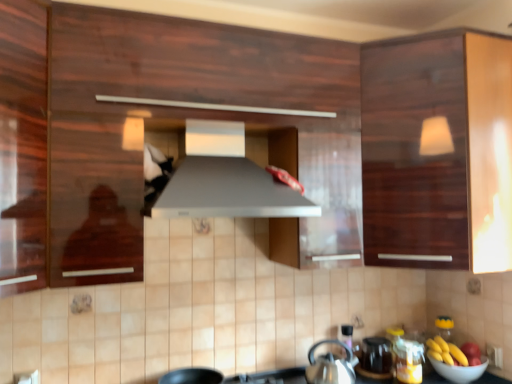
Find the location of a particular element. The width and height of the screenshot is (512, 384). satin silver exhaust hood at center is located at coordinates (226, 181).

I want to click on yellow matte bananas at lower right, so click(x=448, y=353).

You are a GUI agent. You are given a task and a screenshot of the screen. Output one action in this format:
    pyautogui.click(x=<x>, y=<y>)
    Task: Click on the glossy wood cabinet at upper right
    
    Given the screenshot: What is the action you would take?
    pyautogui.click(x=438, y=151)

What do you see at coordinates (376, 355) in the screenshot? I see `matte black kettle at lower center` at bounding box center [376, 355].

Find the location of a particular element. The image size is (512, 384). satin silver exhaust hood at center is located at coordinates (226, 181).

Considering the relative sizes of satin silver exhaust hood at center and glossy wood cabinet at upper right in the image provided, is satin silver exhaust hood at center taller than glossy wood cabinet at upper right?

Incorrect, the height of satin silver exhaust hood at center is not larger of that of glossy wood cabinet at upper right.

From a real-world perspective, which is physically above, satin silver exhaust hood at center or glossy wood cabinet at upper right?

From a 3D spatial view, glossy wood cabinet at upper right is above.

Can you confirm if satin silver exhaust hood at center is thinner than glossy wood cabinet at upper right?

Yes, satin silver exhaust hood at center is thinner than glossy wood cabinet at upper right.

Could you tell me if satin silver exhaust hood at center is facing glossy wood cabinet at upper right?

No.

From a real-world perspective, is matte black kettle at lower center positioned above or below silver metallic kettle at lower center?

matte black kettle at lower center is situated lower than silver metallic kettle at lower center in the real world.

Relative to silver metallic kettle at lower center, is matte black kettle at lower center in front or behind?

Visually, matte black kettle at lower center is located behind silver metallic kettle at lower center.

Is matte black kettle at lower center not close to silver metallic kettle at lower center?

matte black kettle at lower center is near silver metallic kettle at lower center, not far away.

Considering the points (370, 347) and (315, 360), which point is in front, point (370, 347) or point (315, 360)?

The point (315, 360) is more forward.

From the image's perspective, who appears lower, white glossy bowl at lower right or satin silver exhaust hood at center?

white glossy bowl at lower right.

Is white glossy bowl at lower right oriented away from satin silver exhaust hood at center?

No.

Is point (460, 382) closer or farther from the camera than point (230, 205)?

Point (460, 382) is farther from the camera than point (230, 205).

In the image, there is a satin silver exhaust hood at center. Where is `bowl below it (from the image's perspective)`? Image resolution: width=512 pixels, height=384 pixels. bowl below it (from the image's perspective) is located at coordinates (459, 370).

The height and width of the screenshot is (384, 512). I want to click on kitchen appliance behind the glossy wood cabinet at upper right, so click(331, 366).

From the picture: From the image's perspective, is glossy wood cabinet at upper right above silver metallic kettle at lower center?

Yes, from the image's perspective, glossy wood cabinet at upper right is over silver metallic kettle at lower center.

Could silver metallic kettle at lower center be considered to be inside glossy wood cabinet at upper right?

No, silver metallic kettle at lower center is not a part of glossy wood cabinet at upper right.

Between glossy wood cabinet at upper right and silver metallic kettle at lower center, which one has more height?

glossy wood cabinet at upper right is taller.

Which object is positioned more to the right, silver metallic kettle at lower center or white glossy bowl at lower right?

white glossy bowl at lower right is more to the right.

Considering the relative positions of silver metallic kettle at lower center and white glossy bowl at lower right in the image provided, is silver metallic kettle at lower center behind white glossy bowl at lower right?

No.

From a real-world perspective, is silver metallic kettle at lower center above or below white glossy bowl at lower right?

From a real-world perspective, silver metallic kettle at lower center is physically above white glossy bowl at lower right.

Is silver metallic kettle at lower center oriented away from white glossy bowl at lower right?

silver metallic kettle at lower center does not have its back to white glossy bowl at lower right.

Is the position of matte black kettle at lower center more distant than that of yellow matte bananas at lower right?

Yes, the depth of matte black kettle at lower center is greater than that of yellow matte bananas at lower right.

Is matte black kettle at lower center shorter than yellow matte bananas at lower right?

No, matte black kettle at lower center is not shorter than yellow matte bananas at lower right.

Is matte black kettle at lower center to the left or to the right of yellow matte bananas at lower right in the image?

Based on their positions, matte black kettle at lower center is located to the left of yellow matte bananas at lower right.

From the image's perspective, which is below, matte black kettle at lower center or yellow matte bananas at lower right?

matte black kettle at lower center.

Could you tell me if satin silver exhaust hood at center is facing silver metallic kettle at lower center?

No, satin silver exhaust hood at center is not turned towards silver metallic kettle at lower center.

Which is more to the right, satin silver exhaust hood at center or silver metallic kettle at lower center?

Positioned to the right is silver metallic kettle at lower center.

From the image's perspective, is satin silver exhaust hood at center on top of silver metallic kettle at lower center?

Yes, from the image's perspective, satin silver exhaust hood at center is over silver metallic kettle at lower center.

Identify the location of exhaust hood lying below the glossy wood cabinet at upper right (from the image's perspective). This screenshot has width=512, height=384. (226, 181).

What are the coordinates of `kitchen appliance lying on the left of matte black kettle at lower center` in the screenshot? It's located at (331, 366).

Estimate the real-world distances between objects in this image. Which object is closer to satin silver exhaust hood at center, glossy wood cabinet at upper right or yellow matte bananas at lower right?

glossy wood cabinet at upper right is positioned closer to the anchor satin silver exhaust hood at center.

Based on their spatial positions, is white glossy bowl at lower right or silver metallic kettle at lower center further from satin silver exhaust hood at center?

The object further to satin silver exhaust hood at center is white glossy bowl at lower right.

Looking at the image, which one is located further to satin silver exhaust hood at center, yellow matte bananas at lower right or matte black kettle at lower center?

yellow matte bananas at lower right is further to satin silver exhaust hood at center.

Which object lies further to the anchor point matte black kettle at lower center, glossy wood cabinet at upper right or satin silver exhaust hood at center?

satin silver exhaust hood at center.

From the image, which object appears to be nearer to glossy wood cabinet at upper right, silver metallic kettle at lower center or yellow matte bananas at lower right?

silver metallic kettle at lower center.

From the picture: Looking at the image, which one is located closer to yellow matte bananas at lower right, matte black kettle at lower center or white glossy bowl at lower right?

white glossy bowl at lower right.

Estimate the real-world distances between objects in this image. Which object is further from silver metallic kettle at lower center, white glossy bowl at lower right or glossy wood cabinet at upper right?

glossy wood cabinet at upper right is further to silver metallic kettle at lower center.

Based on their spatial positions, is satin silver exhaust hood at center or yellow matte bananas at lower right further from matte black kettle at lower center?

satin silver exhaust hood at center lies further to matte black kettle at lower center than the other object.

Find the location of a particular element. The height and width of the screenshot is (384, 512). banana located between matte black kettle at lower center and white glossy bowl at lower right in the left-right direction is located at coordinates (448, 353).

Identify the location of banana that lies between glossy wood cabinet at upper right and white glossy bowl at lower right from top to bottom. This screenshot has height=384, width=512. (448, 353).

This screenshot has width=512, height=384. Find the location of `appliance between silver metallic kettle at lower center and white glossy bowl at lower right from left to right`. appliance between silver metallic kettle at lower center and white glossy bowl at lower right from left to right is located at coordinates (376, 355).

Where is `banana between glossy wood cabinet at upper right and silver metallic kettle at lower center from top to bottom`? banana between glossy wood cabinet at upper right and silver metallic kettle at lower center from top to bottom is located at coordinates (448, 353).